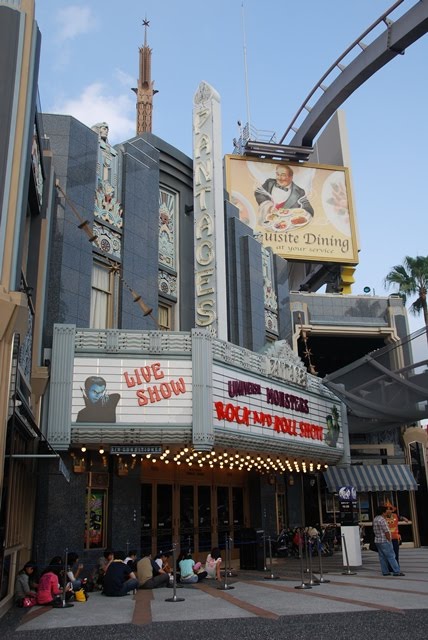
Where is `poster`? poster is located at coordinates (96, 502).